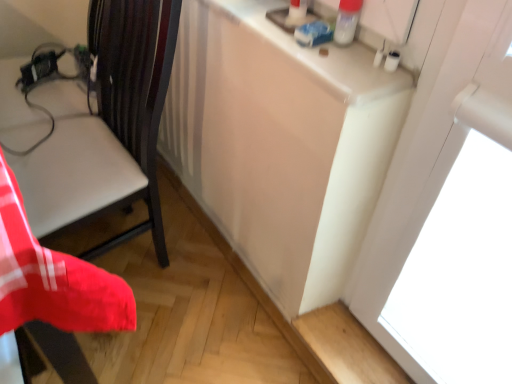
Image resolution: width=512 pixels, height=384 pixels. What do you see at coordinates (320, 56) in the screenshot?
I see `white glossy counter top at upper right` at bounding box center [320, 56].

Where is `white glossy counter top at upper right`? white glossy counter top at upper right is located at coordinates (320, 56).

Where is `matte black chair at left`? The height and width of the screenshot is (384, 512). matte black chair at left is located at coordinates (96, 125).

What do you see at coordinates (96, 125) in the screenshot? The height and width of the screenshot is (384, 512). I see `matte black chair at left` at bounding box center [96, 125].

This screenshot has height=384, width=512. In order to click on white glossy counter top at upper right in this screenshot , I will do `click(320, 56)`.

Between white glossy counter top at upper right and matte black chair at left, which one appears on the left side from the viewer's perspective?

matte black chair at left.

Which object is further away from the camera, white glossy counter top at upper right or matte black chair at left?

white glossy counter top at upper right is further from the camera.

Is point (408, 81) closer or farther from the camera than point (102, 112)?

Clearly, point (408, 81) is closer to the camera than point (102, 112).

From the image's perspective, does white glossy counter top at upper right appear lower than matte black chair at left?

No, from the image's perspective, white glossy counter top at upper right is not beneath matte black chair at left.

From a real-world perspective, is white glossy counter top at upper right below matte black chair at left?

Incorrect, from a real-world perspective, white glossy counter top at upper right is higher than matte black chair at left.

Is white glossy counter top at upper right thinner than matte black chair at left?

Yes, white glossy counter top at upper right is thinner than matte black chair at left.

Who is shorter, white glossy counter top at upper right or matte black chair at left?

Standing shorter between the two is white glossy counter top at upper right.

Considering the relative sizes of white glossy counter top at upper right and matte black chair at left in the image provided, is white glossy counter top at upper right smaller than matte black chair at left?

Correct, white glossy counter top at upper right occupies less space than matte black chair at left.

Can we say white glossy counter top at upper right lies outside matte black chair at left?

Yes.

Are white glossy counter top at upper right and matte black chair at left located far from each other?

white glossy counter top at upper right is actually quite close to matte black chair at left.

Is white glossy counter top at upper right oriented away from matte black chair at left?

No, white glossy counter top at upper right is not facing away from matte black chair at left.

Identify the location of chair that appears on the left of white glossy counter top at upper right. This screenshot has height=384, width=512. (96, 125).

Is matte black chair at left to the right of white glossy counter top at upper right from the viewer's perspective?

No, matte black chair at left is not to the right of white glossy counter top at upper right.

Consider the image. Is matte black chair at left further to camera compared to white glossy counter top at upper right?

No, it is in front of white glossy counter top at upper right.

Considering the points (145, 3) and (305, 57), which point is behind, point (145, 3) or point (305, 57)?

Point (145, 3)

From the image's perspective, is matte black chair at left below white glossy counter top at upper right?

Correct, matte black chair at left appears lower than white glossy counter top at upper right in the image.

From a real-world perspective, relative to white glossy counter top at upper right, is matte black chair at left vertically above or below?

matte black chair at left is below white glossy counter top at upper right.

Between matte black chair at left and white glossy counter top at upper right, which one has smaller width?

white glossy counter top at upper right is thinner.

Considering the relative sizes of matte black chair at left and white glossy counter top at upper right in the image provided, is matte black chair at left taller than white glossy counter top at upper right?

Correct, matte black chair at left is much taller as white glossy counter top at upper right.

Looking at the image, does matte black chair at left seem bigger or smaller compared to white glossy counter top at upper right?

Considering their sizes, matte black chair at left takes up more space than white glossy counter top at upper right.

Is matte black chair at left not inside white glossy counter top at upper right?

matte black chair at left lies outside white glossy counter top at upper right's area.

Would you say matte black chair at left is a long distance from white glossy counter top at upper right?

They are positioned close to each other.

Is white glossy counter top at upper right at the back of matte black chair at left?

No, matte black chair at left is not facing away from white glossy counter top at upper right.

How distant is matte black chair at left from white glossy counter top at upper right?

The distance of matte black chair at left from white glossy counter top at upper right is 18.16 inches.

This screenshot has height=384, width=512. In the image, there is a white glossy counter top at upper right. Find the location of `chair below it (from the image's perspective)`. chair below it (from the image's perspective) is located at coordinates (96, 125).

The width and height of the screenshot is (512, 384). There is a matte black chair at left. What are the coordinates of `counter top above it (from a real-world perspective)` in the screenshot? It's located at (320, 56).

Find the location of a particular element. The width and height of the screenshot is (512, 384). counter top behind the matte black chair at left is located at coordinates (320, 56).